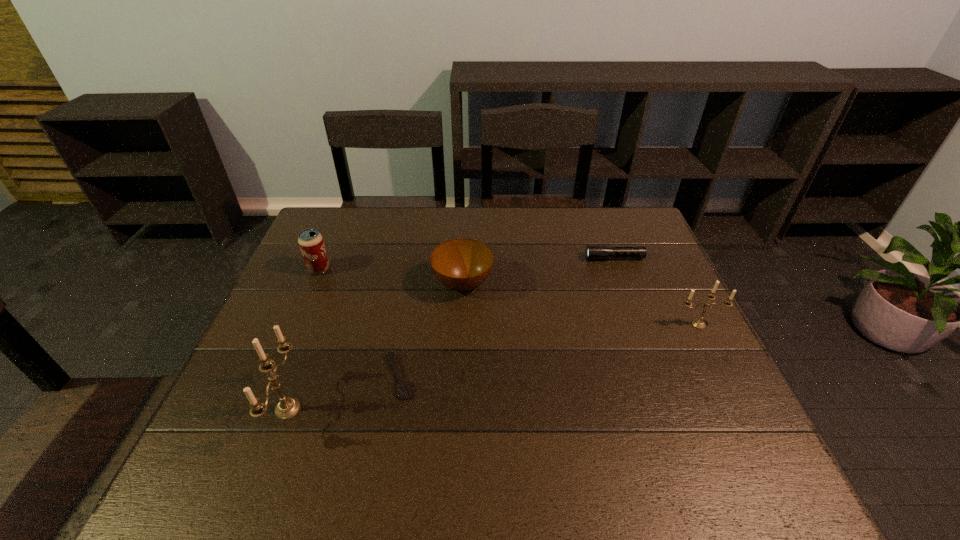
If equal spacing is the goal by inserting an additional candle among them, please point out a vacant space for this new candle. Please provide its 2D coordinates. Your answer should be formatted as a tuple, i.e. [(x, y)], where the tuple contains the x and y coordinates of a point satisfying the conditions above.

[(512, 363)]